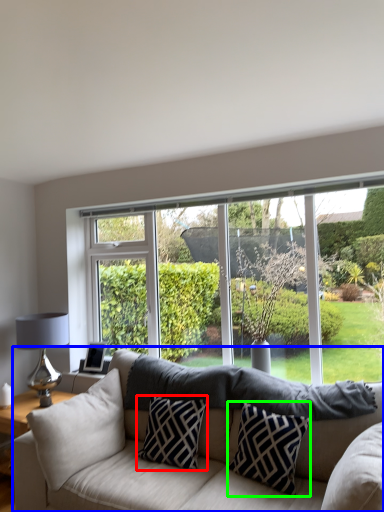
Question: Based on their relative distances, which object is farther from pillow (highlighted by a red box)? Choose from studio couch (highlighted by a blue box) and pillow (highlighted by a green box).

Choices:
 (A) studio couch
 (B) pillow

Answer: (B)